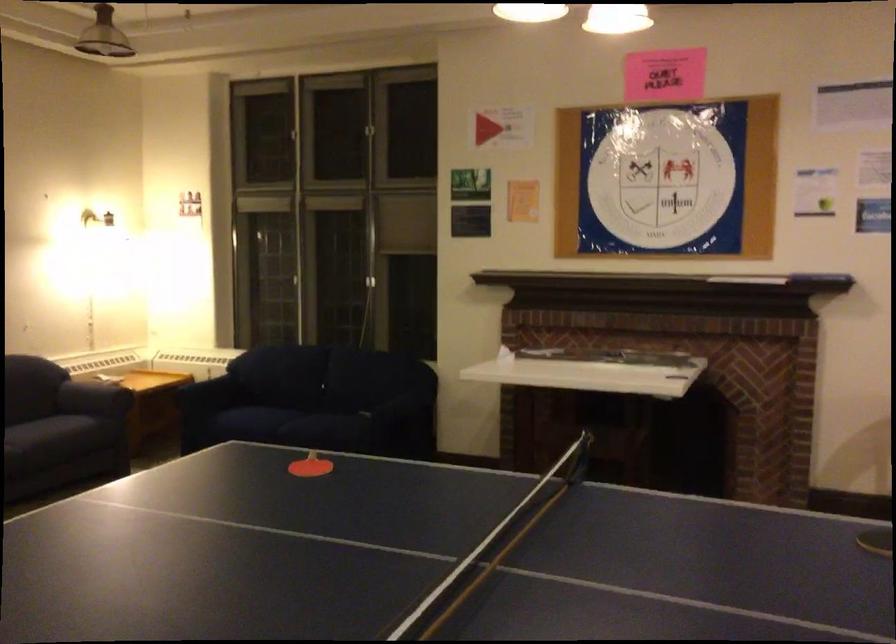
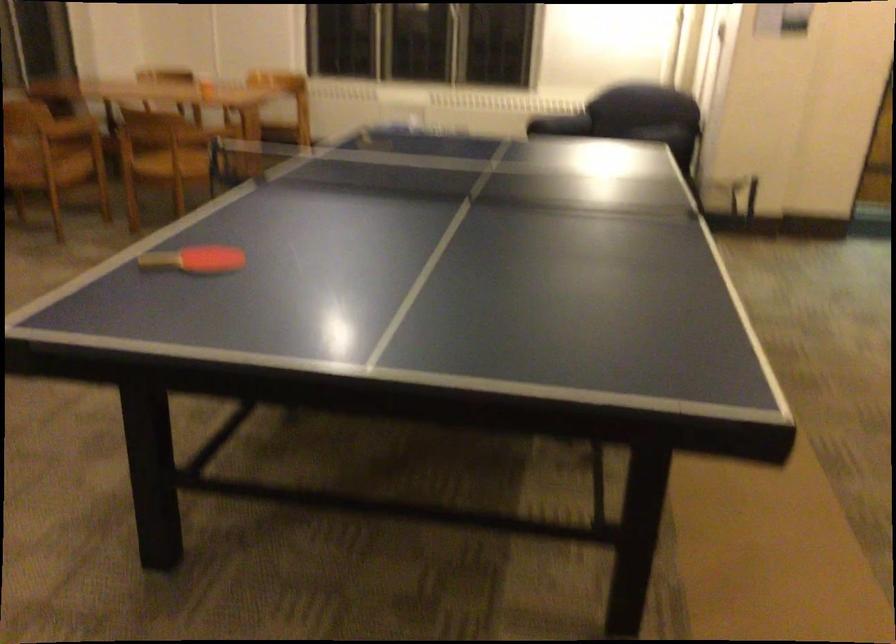
Locate, in the second image, the point that corresponds to (297,491) in the first image.

(194, 259)